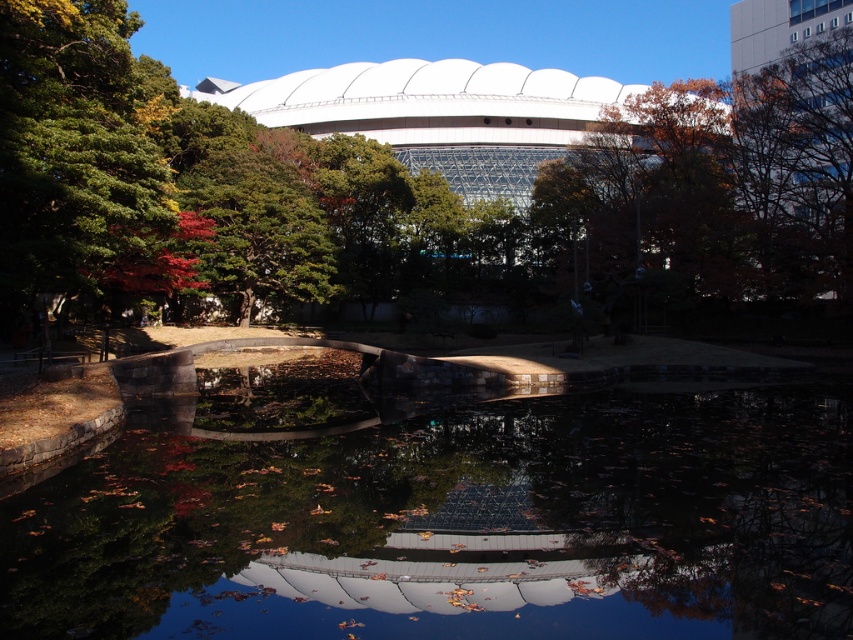
Can you confirm if green leafy tree at center is smaller than dark reflective water at center?

No.

Is green leafy tree at center bigger than dark reflective water at center?

Correct, green leafy tree at center is larger in size than dark reflective water at center.

Is point (616, 205) in front of point (546, 531)?

No, (616, 205) is further to viewer.

Image resolution: width=853 pixels, height=640 pixels. I want to click on green leafy tree at center, so click(x=419, y=176).

Between dark reflective water at center and green leafy tree at left, which one appears on the right side from the viewer's perspective?

Positioned to the right is dark reflective water at center.

Consider the image. Can you confirm if dark reflective water at center is taller than green leafy tree at left?

No.

Image resolution: width=853 pixels, height=640 pixels. I want to click on dark reflective water at center, so click(x=456, y=525).

You are a GUI agent. You are given a task and a screenshot of the screen. Output one action in this format:
    pyautogui.click(x=<x>, y=<y>)
    Task: Click on the green leafy tree at center
    The height and width of the screenshot is (640, 853).
    Given the screenshot: What is the action you would take?
    pyautogui.click(x=419, y=176)

Who is positioned more to the left, green leafy tree at center or green leafy tree at left?

green leafy tree at left is more to the left.

You are a GUI agent. You are given a task and a screenshot of the screen. Output one action in this format:
    pyautogui.click(x=<x>, y=<y>)
    Task: Click on the green leafy tree at center
    This screenshot has width=853, height=640.
    Given the screenshot: What is the action you would take?
    pyautogui.click(x=419, y=176)